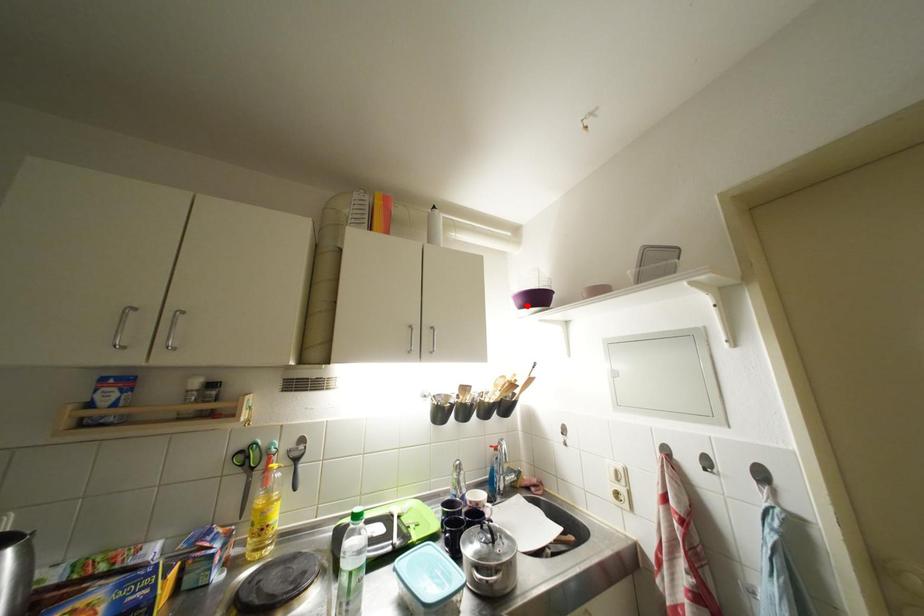
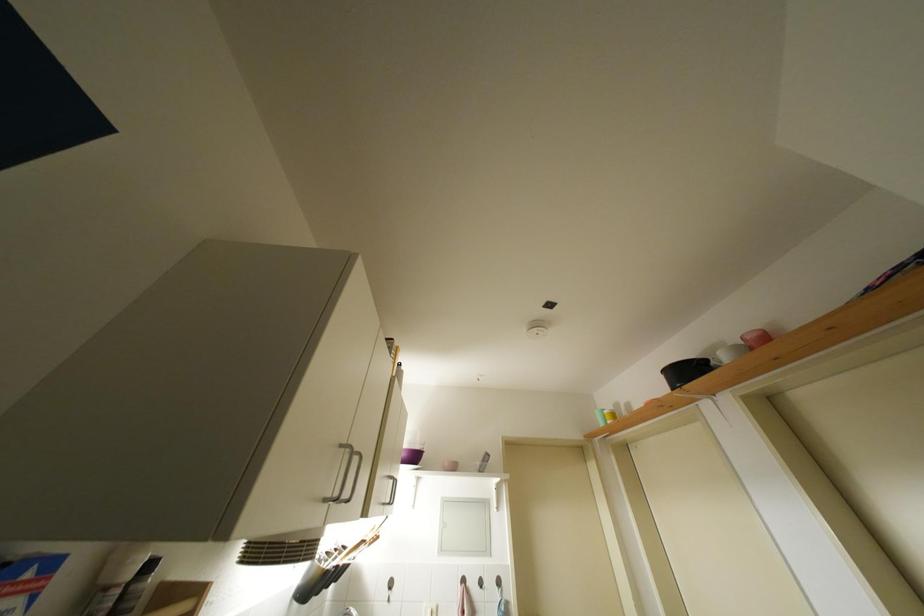
Where in the second image is the point corresponding to the highlighted location from the first image?

(410, 459)